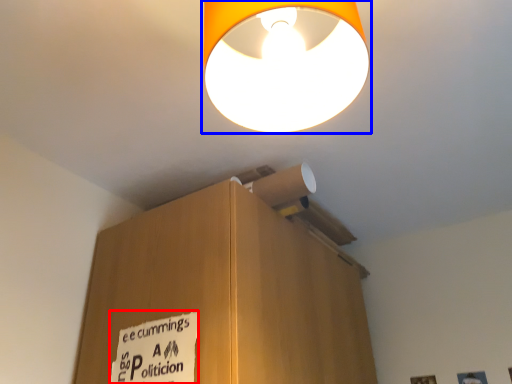
Question: Among these objects, which one is nearest to the camera, warning sign (highlighted by a red box) or lamp (highlighted by a blue box)?

Choices:
 (A) warning sign
 (B) lamp

Answer: (B)